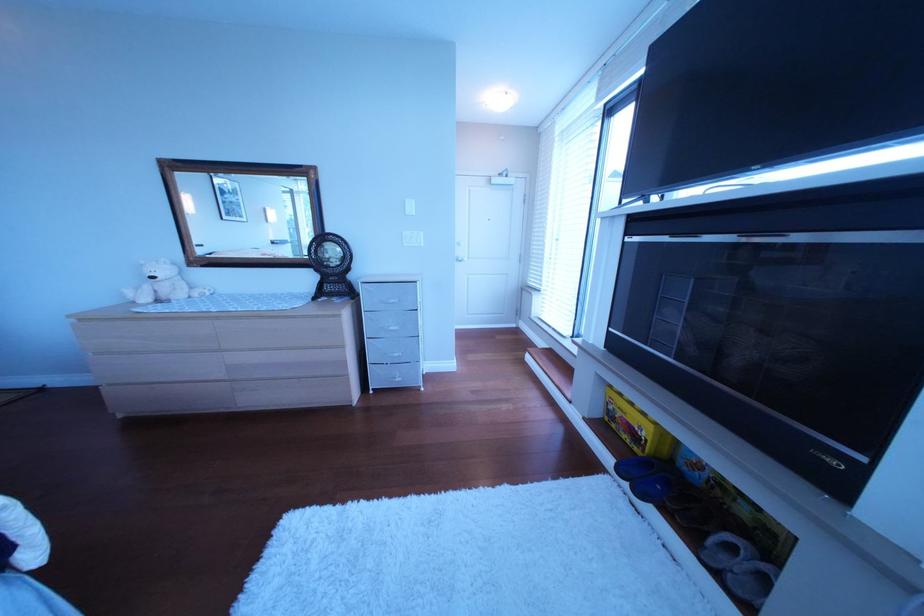
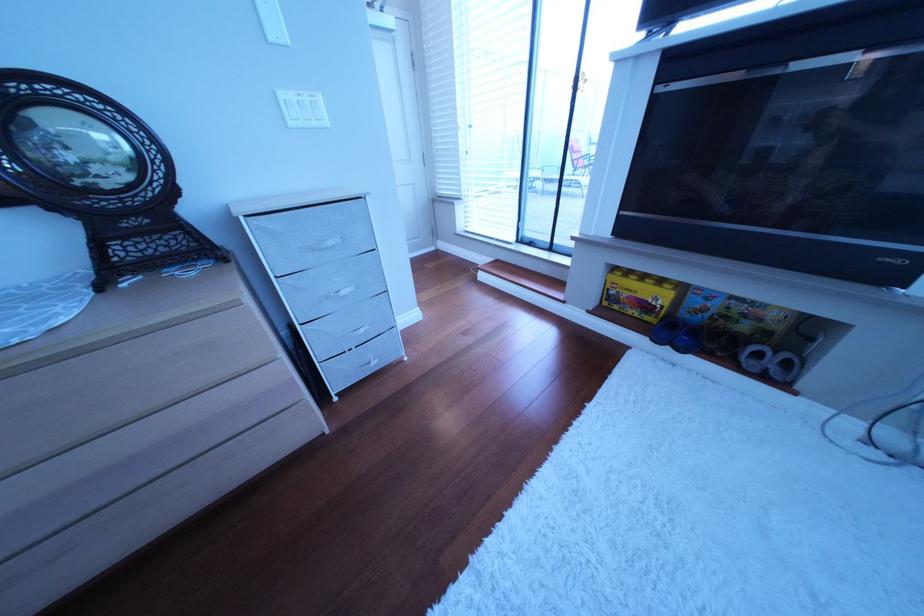
Locate, in the second image, the point that corresponds to pixel 420 246 in the first image.

(307, 126)